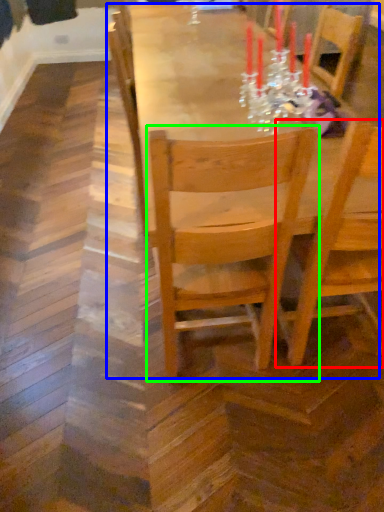
Question: Based on their relative distances, which object is farther from chair (highlighted by a red box)? Choose from table (highlighted by a blue box) and chair (highlighted by a green box).

Choices:
 (A) table
 (B) chair

Answer: (A)